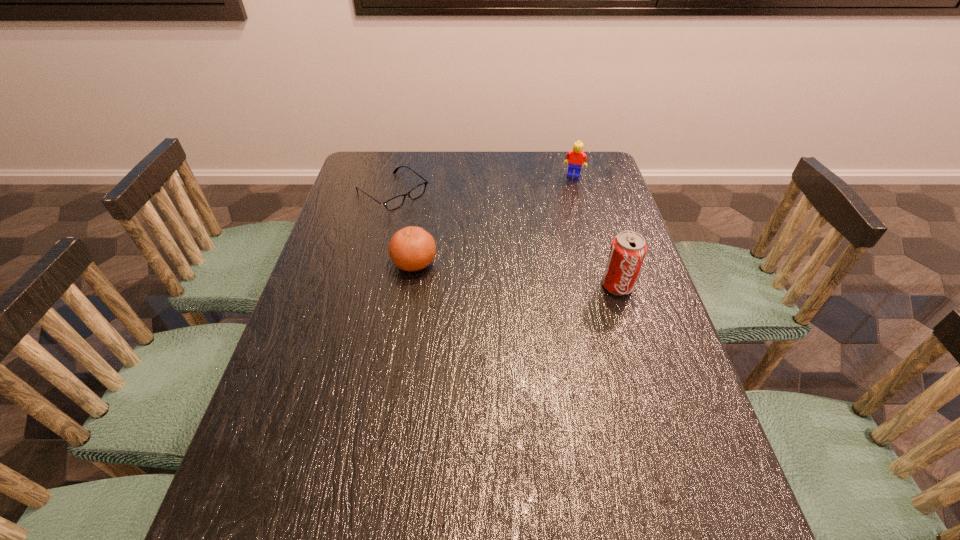
This screenshot has height=540, width=960. In order to click on vacant spot on the desktop that is between the third tallest object and the soda can and is positioned on the front-facing side of the third shortest object in this screenshot , I will do click(540, 277).

Where is `free space on the desktop that is between the second shortest object and the tallest object and is positioned on the front-facing side of the spectacles`? The image size is (960, 540). free space on the desktop that is between the second shortest object and the tallest object and is positioned on the front-facing side of the spectacles is located at coordinates (512, 274).